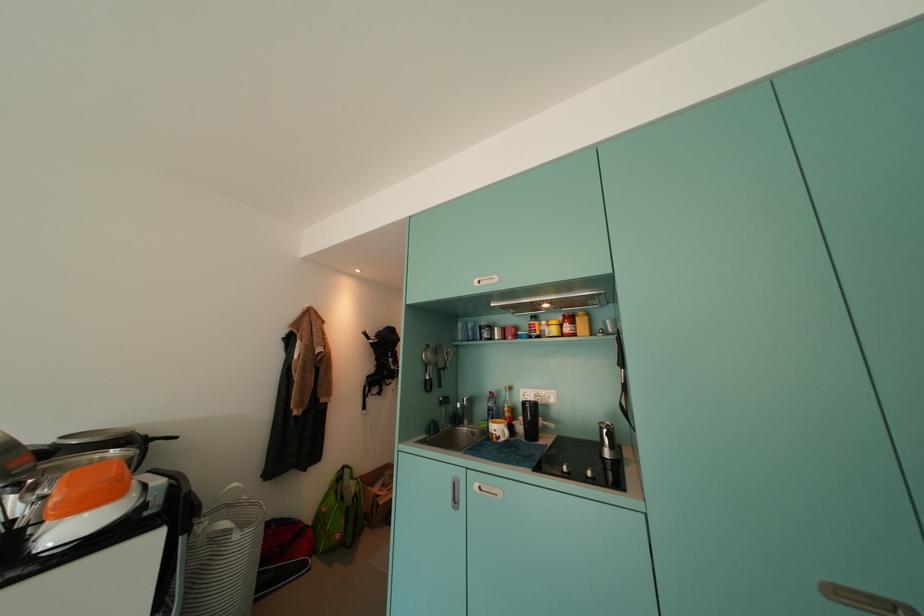
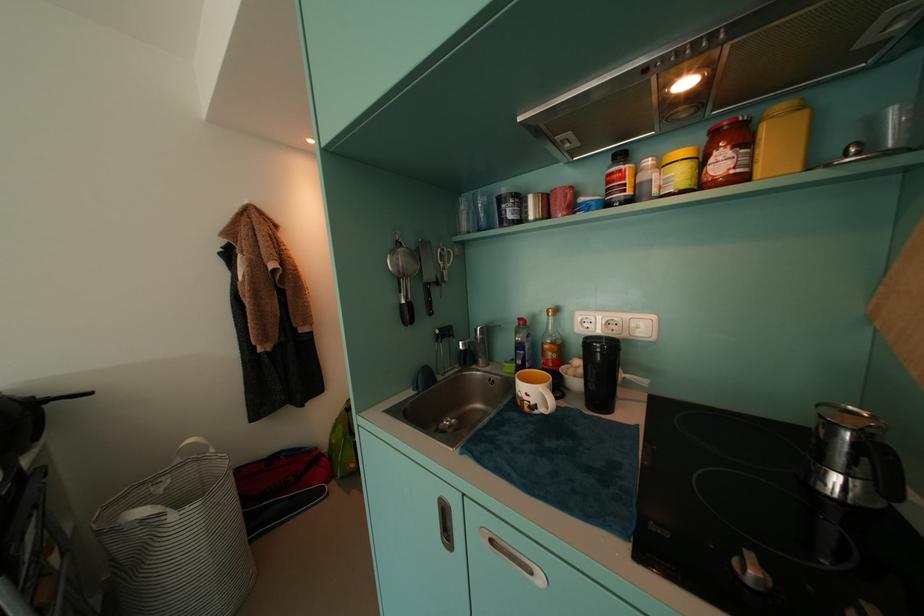
Find the pixel in the second image that matches the point at 511,442 in the first image.

(550, 413)